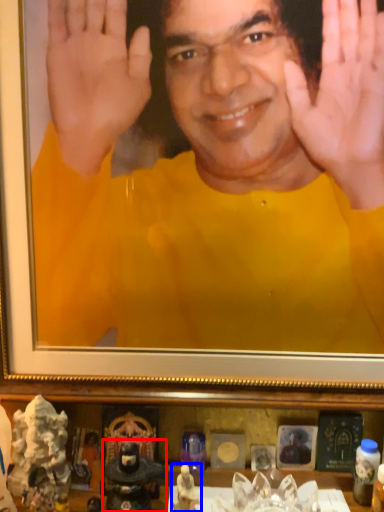
Question: Among these objects, which one is nearest to the camera, figurine (highlighted by a red box) or toy (highlighted by a blue box)?

Choices:
 (A) figurine
 (B) toy

Answer: (B)